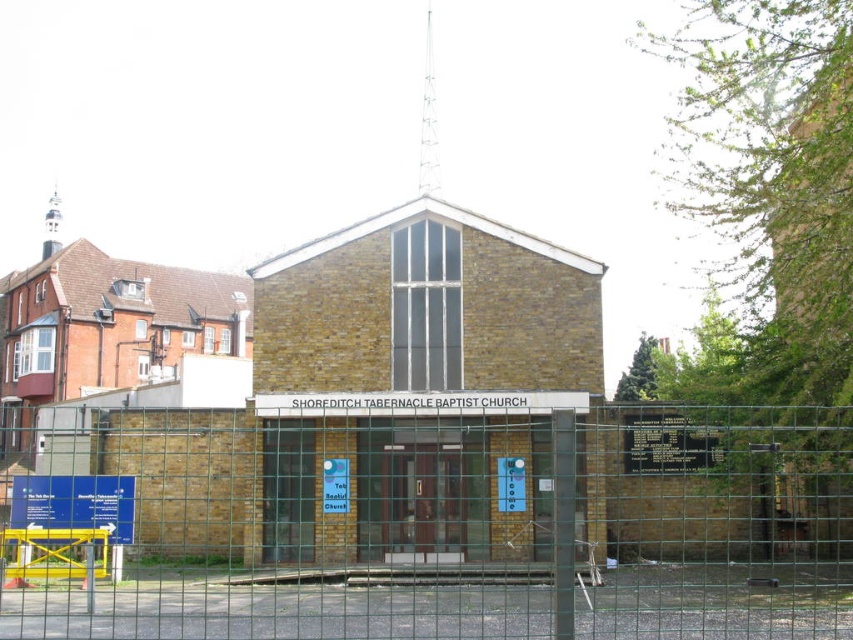
Is blue plastic sign at lower left bigger than white paper sign at center?

No.

Is blue plastic sign at lower left taller than white paper sign at center?

In fact, blue plastic sign at lower left may be shorter than white paper sign at center.

Image resolution: width=853 pixels, height=640 pixels. Find the location of `blue plastic sign at lower left`. blue plastic sign at lower left is located at coordinates (74, 502).

At what (x,y) coordinates should I click in order to perform the action: click on blue plastic sign at lower left. Please return your answer as a coordinate pair (x, y). The width and height of the screenshot is (853, 640). Looking at the image, I should click on (74, 502).

Can you confirm if green wire mesh fence at center is thinner than blue plastic sign at lower left?

In fact, green wire mesh fence at center might be wider than blue plastic sign at lower left.

Is green wire mesh fence at center below blue plastic sign at lower left?

Correct, green wire mesh fence at center is located below blue plastic sign at lower left.

Does point (433, 582) come farther from viewer compared to point (108, 488)?

That is False.

In order to click on green wire mesh fence at center in this screenshot , I will do `click(457, 529)`.

Can you confirm if green wire mesh fence at center is positioned above white paper sign at center?

Actually, green wire mesh fence at center is below white paper sign at center.

You are a GUI agent. You are given a task and a screenshot of the screen. Output one action in this format:
    pyautogui.click(x=<x>, y=<y>)
    Task: Click on the green wire mesh fence at center
    The width and height of the screenshot is (853, 640).
    Given the screenshot: What is the action you would take?
    pyautogui.click(x=457, y=529)

Is point (743, 440) positioned behind point (345, 497)?

No, it is in front of (345, 497).

Image resolution: width=853 pixels, height=640 pixels. I want to click on green wire mesh fence at center, so click(x=457, y=529).